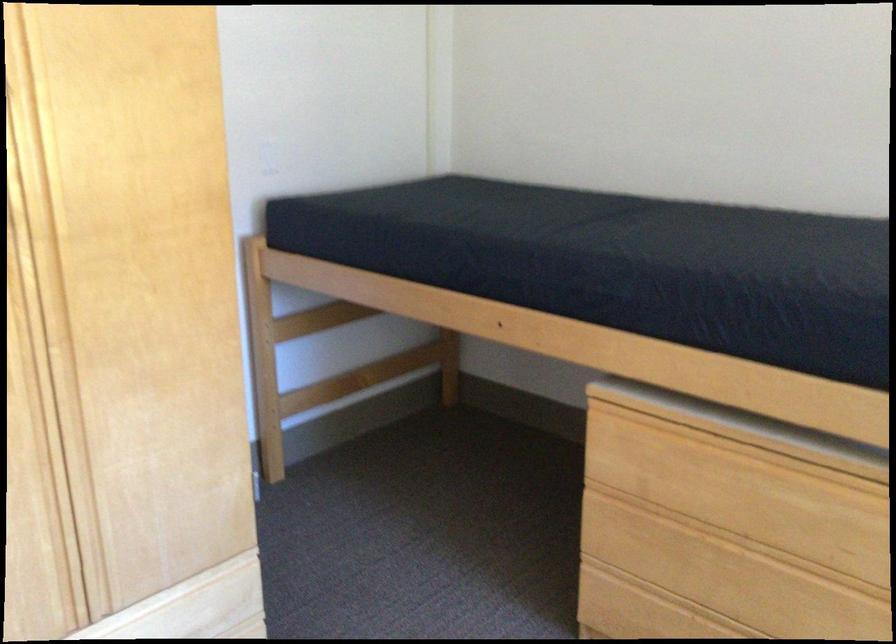
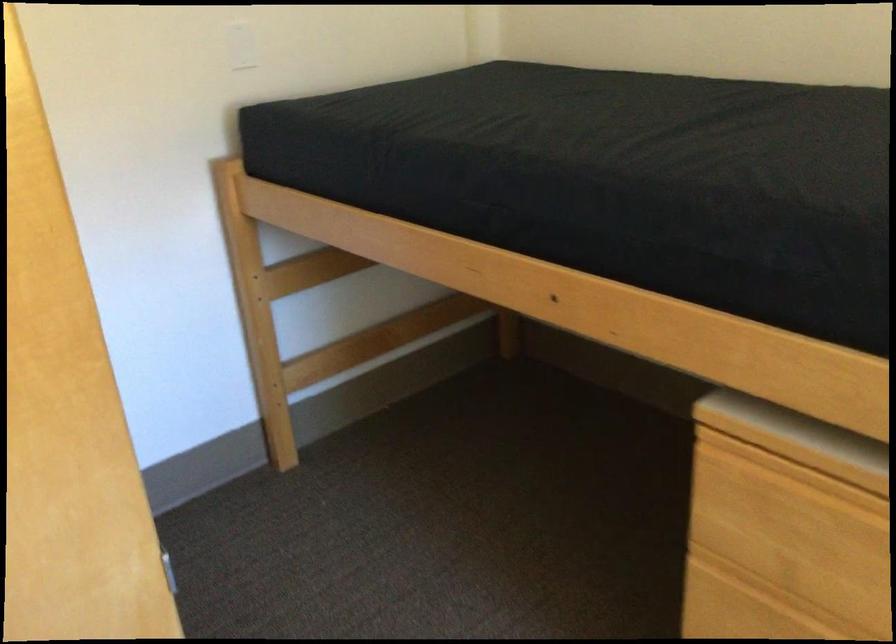
Locate, in the second image, the point that corresponds to pixel 677 424 in the first image.

(837, 474)